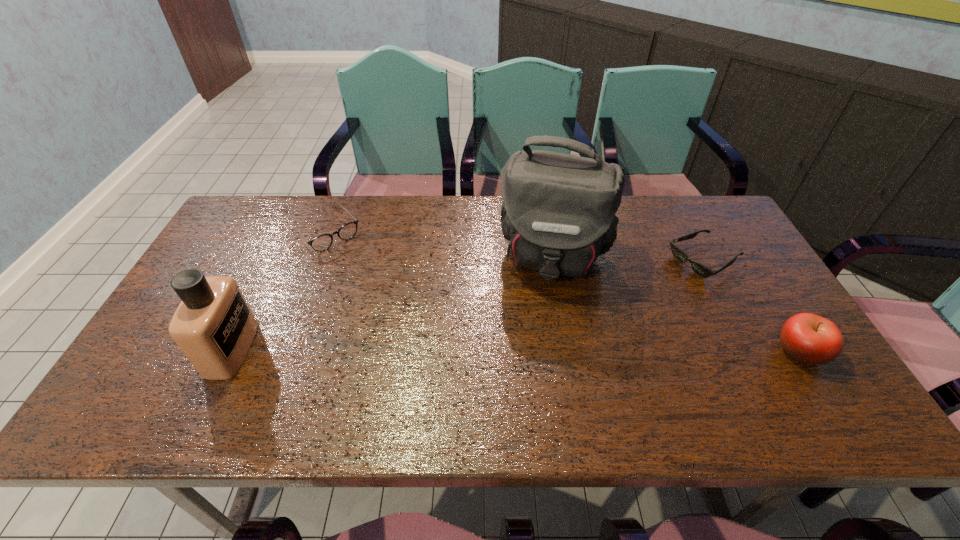
Find the location of a particular element. perfume located at the near edge is located at coordinates (214, 327).

Find the location of `apple positioned at the near edge`. apple positioned at the near edge is located at coordinates (808, 338).

The height and width of the screenshot is (540, 960). What are the coordinates of `object present at the left edge` in the screenshot? It's located at (214, 327).

This screenshot has height=540, width=960. I want to click on apple situated at the right edge, so click(808, 338).

The width and height of the screenshot is (960, 540). In order to click on sunglasses that is at the right edge in this screenshot , I will do `click(700, 269)`.

Locate an element on the screen. This screenshot has width=960, height=540. object located in the near left corner section of the desktop is located at coordinates pos(214,327).

Where is `object located in the far right corner section of the desktop`? The height and width of the screenshot is (540, 960). object located in the far right corner section of the desktop is located at coordinates (700, 269).

At what (x,y) coordinates should I click in order to perform the action: click on object that is at the near right corner. Please return your answer as a coordinate pair (x, y). Looking at the image, I should click on (808, 338).

You are a GUI agent. You are given a task and a screenshot of the screen. Output one action in this format:
    pyautogui.click(x=<x>, y=<y>)
    Task: Click on the free spot at the far edge of the desktop
    This screenshot has width=960, height=540.
    Given the screenshot: What is the action you would take?
    pyautogui.click(x=324, y=231)

This screenshot has height=540, width=960. What are the coordinates of `vacant space at the near edge` in the screenshot? It's located at (462, 379).